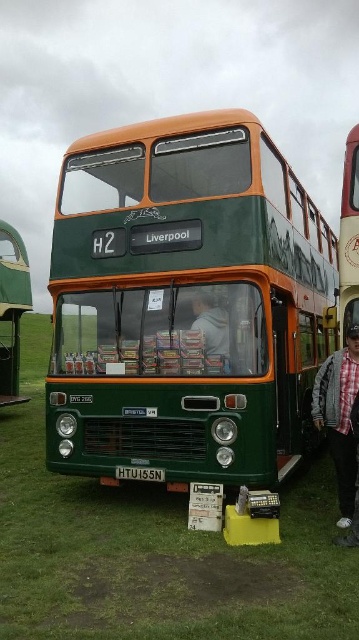
Can you confirm if plaid fabric shirt at lower right is positioned to the left of green matte bus at left?

In fact, plaid fabric shirt at lower right is to the right of green matte bus at left.

Does point (352, 340) lie in front of point (2, 232)?

That is True.

Find the location of a particular element. Image resolution: width=359 pixels, height=640 pixels. plaid fabric shirt at lower right is located at coordinates (339, 417).

Who is lower down, green grass at center or green fabric jacket at center?

green grass at center

Who is higher up, green grass at center or green fabric jacket at center?

green fabric jacket at center is higher up.

This screenshot has width=359, height=640. Identify the location of green grass at center. (155, 550).

Can you confirm if green matte bus at left is positioned to the right of green matte bus at center?

Incorrect, green matte bus at left is not on the right side of green matte bus at center.

Does green matte bus at left have a lesser width compared to green matte bus at center?

Yes, green matte bus at left is thinner than green matte bus at center.

Does point (19, 252) lie behind point (348, 205)?

Yes, point (19, 252) is farther from viewer.

This screenshot has width=359, height=640. I want to click on green matte bus at left, so [11, 308].